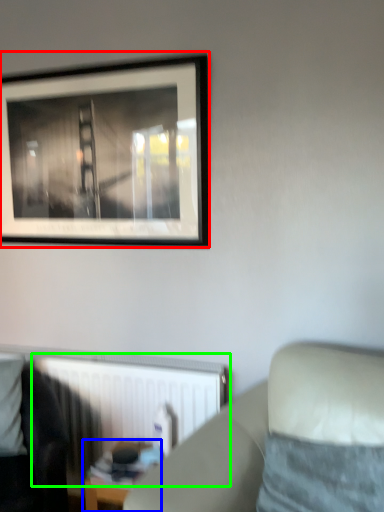
Question: Which is farther away from picture frame (highlighted by a red box)? table (highlighted by a blue box) or radiator (highlighted by a green box)?

Choices:
 (A) table
 (B) radiator

Answer: (A)